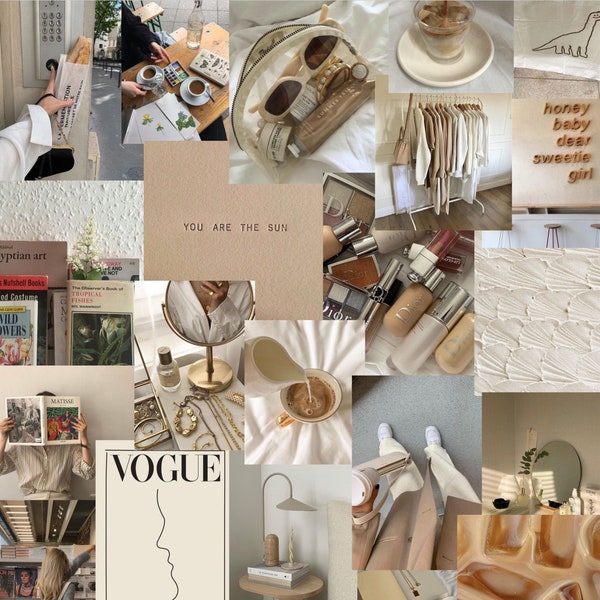
This screenshot has width=600, height=600. I want to click on books (in photo), so point(100,310), point(113,273), point(56,308), point(37,262), point(19,287), point(20,323), point(279,573), point(276,585), point(49,428).